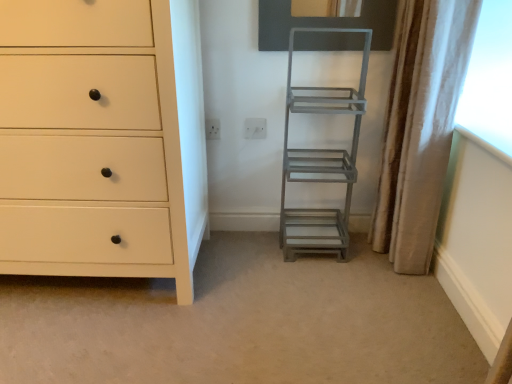
Question: Considering the relative sizes of matte white chest of drawers at left and white plastic electric outlet at center, marked as the first electric outlet in a right-to-left arrangement, in the image provided, is matte white chest of drawers at left taller than white plastic electric outlet at center, marked as the first electric outlet in a right-to-left arrangement,?

Choices:
 (A) yes
 (B) no

Answer: (A)

Question: From the image's perspective, is matte white chest of drawers at left above white plastic electric outlet at center, the second electric outlet viewed from the left?

Choices:
 (A) no
 (B) yes

Answer: (A)

Question: From a real-world perspective, is matte white chest of drawers at left physically above white plastic electric outlet at center, the second electric outlet viewed from the left?

Choices:
 (A) yes
 (B) no

Answer: (A)

Question: Is matte white chest of drawers at left at the right side of white plastic electric outlet at center, marked as the first electric outlet in a right-to-left arrangement?

Choices:
 (A) no
 (B) yes

Answer: (A)

Question: Is matte white chest of drawers at left to the left of white plastic electric outlet at center, the second electric outlet viewed from the left, from the viewer's perspective?

Choices:
 (A) no
 (B) yes

Answer: (B)

Question: Does matte white chest of drawers at left have a lesser height compared to white plastic electric outlet at center, marked as the first electric outlet in a right-to-left arrangement?

Choices:
 (A) no
 (B) yes

Answer: (A)

Question: Does matte white chest of drawers at left appear on the left side of beige fabric curtain at right?

Choices:
 (A) no
 (B) yes

Answer: (B)

Question: From a real-world perspective, is matte white chest of drawers at left positioned under beige fabric curtain at right based on gravity?

Choices:
 (A) no
 (B) yes

Answer: (B)

Question: Does matte white chest of drawers at left have a lesser width compared to beige fabric curtain at right?

Choices:
 (A) no
 (B) yes

Answer: (A)

Question: Could beige fabric curtain at right be considered to be inside matte white chest of drawers at left?

Choices:
 (A) no
 (B) yes

Answer: (A)

Question: Does matte white chest of drawers at left turn towards beige fabric curtain at right?

Choices:
 (A) yes
 (B) no

Answer: (B)

Question: Considering the relative sizes of matte white chest of drawers at left and beige fabric curtain at right in the image provided, is matte white chest of drawers at left wider than beige fabric curtain at right?

Choices:
 (A) yes
 (B) no

Answer: (A)

Question: Is white plastic electric outlet at center, marked as the first electric outlet in a right-to-left arrangement, to the right of beige fabric curtain at right from the viewer's perspective?

Choices:
 (A) yes
 (B) no

Answer: (B)